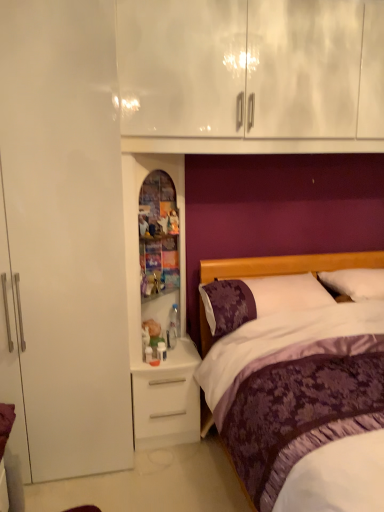
The width and height of the screenshot is (384, 512). Identify the location of white glossy medicine cabinet at center. (137, 232).

Locate an element on the screen. purple satin pillow at right, the first pillow when ordered from right to left is located at coordinates (355, 283).

Describe the element at coordinates (355, 283) in the screenshot. I see `purple satin pillow at right, which appears as the 2th pillow when viewed from the left` at that location.

Identify the location of purple satin bed at center. This screenshot has width=384, height=512. (287, 265).

This screenshot has width=384, height=512. Identify the location of white matte desk at lower center. (167, 399).

Locate an element on the screen. This screenshot has height=512, width=384. white glossy medicine cabinet at center is located at coordinates (137, 232).

From a real-world perspective, which pillow is the 1st one underneath the white glossy medicine cabinet at center? Please provide its 2D coordinates.

[(355, 283)]

How distant is white glossy medicine cabinet at center from purple satin pillow at right, the first pillow when ordered from right to left?

white glossy medicine cabinet at center is 3.33 feet away from purple satin pillow at right, the first pillow when ordered from right to left.

Is white glossy medicine cabinet at center located outside purple satin pillow at right, which appears as the 2th pillow when viewed from the left?

Indeed, white glossy medicine cabinet at center is completely outside purple satin pillow at right, which appears as the 2th pillow when viewed from the left.

Between white glossy medicine cabinet at center and purple satin pillow at right, the first pillow when ordered from right to left, which one has smaller size?

purple satin pillow at right, the first pillow when ordered from right to left.

Choose the correct answer: Is white matte desk at lower center inside purple satin bed at center or outside it?

white matte desk at lower center exists outside the volume of purple satin bed at center.

From the image's perspective, is white matte desk at lower center above or below purple satin bed at center?

white matte desk at lower center is below purple satin bed at center.

Which point is more forward, (158, 384) or (208, 336)?

The point (158, 384) is closer.

From the image's perspective, is purple floral pillow at right, the 1th pillow in the left-to-right sequence, above or below purple satin pillow at right, which appears as the 2th pillow when viewed from the left?

Clearly, from the image's perspective, purple floral pillow at right, the 1th pillow in the left-to-right sequence, is below purple satin pillow at right, which appears as the 2th pillow when viewed from the left.

Is purple floral pillow at right, which appears as the second pillow when viewed from the right, further to camera compared to purple satin pillow at right, the first pillow when ordered from right to left?

No, the depth of purple floral pillow at right, which appears as the second pillow when viewed from the right, is less than that of purple satin pillow at right, the first pillow when ordered from right to left.

From a real-world perspective, between purple floral pillow at right, the 1th pillow in the left-to-right sequence, and purple satin pillow at right, which appears as the 2th pillow when viewed from the left, who is vertically lower?

purple floral pillow at right, the 1th pillow in the left-to-right sequence, from a real-world perspective.

Can you confirm if purple floral pillow at right, the 1th pillow in the left-to-right sequence, is wider than purple satin pillow at right, which appears as the 2th pillow when viewed from the left?

Yes.

Are purple floral pillow at right, the 1th pillow in the left-to-right sequence, and purple satin bed at center located far from each other?

purple floral pillow at right, the 1th pillow in the left-to-right sequence, is near purple satin bed at center, not far away.

Is point (238, 301) closer to viewer compared to point (282, 269)?

Yes, point (238, 301) is in front of point (282, 269).

Can you confirm if purple floral pillow at right, which appears as the second pillow when viewed from the right, is positioned to the left of purple satin bed at center?

Yes.

Between purple floral pillow at right, the 1th pillow in the left-to-right sequence, and purple satin bed at center, which one has smaller size?

purple floral pillow at right, the 1th pillow in the left-to-right sequence.

Which is in front, point (217, 325) or point (129, 199)?

The point (129, 199) is closer to the camera.

This screenshot has height=512, width=384. Find the location of `medicine cabinet in front of the purple floral pillow at right, which appears as the second pillow when viewed from the right`. medicine cabinet in front of the purple floral pillow at right, which appears as the second pillow when viewed from the right is located at coordinates (137, 232).

Is purple floral pillow at right, which appears as the second pillow when viewed from the right, looking in the opposite direction of white glossy medicine cabinet at center?

No, purple floral pillow at right, which appears as the second pillow when viewed from the right, is not facing the opposite direction of white glossy medicine cabinet at center.

Would you say white glossy medicine cabinet at center is part of purple floral pillow at right, the 1th pillow in the left-to-right sequence,'s contents?

No.

Is purple floral pillow at right, the 1th pillow in the left-to-right sequence, facing away from white matte desk at lower center?

purple floral pillow at right, the 1th pillow in the left-to-right sequence, does not have its back to white matte desk at lower center.

What are the coordinates of `pillow in front of the white matte desk at lower center` in the screenshot? It's located at tap(258, 298).

In the scene shown: From the image's perspective, is purple floral pillow at right, which appears as the second pillow when viewed from the right, positioned above or below white matte desk at lower center?

Based on their image positions, purple floral pillow at right, which appears as the second pillow when viewed from the right, is located above white matte desk at lower center.

Which is more to the right, purple floral pillow at right, which appears as the second pillow when viewed from the right, or white matte desk at lower center?

From the viewer's perspective, purple floral pillow at right, which appears as the second pillow when viewed from the right, appears more on the right side.

Is purple satin pillow at right, the first pillow when ordered from right to left, positioned far away from white matte desk at lower center?

Yes, purple satin pillow at right, the first pillow when ordered from right to left, and white matte desk at lower center are located far from each other.

Could you tell me if purple satin pillow at right, the first pillow when ordered from right to left, is turned towards white matte desk at lower center?

No, purple satin pillow at right, the first pillow when ordered from right to left, is not facing towards white matte desk at lower center.

Based on the photo, is purple satin pillow at right, the first pillow when ordered from right to left, thinner than white matte desk at lower center?

Correct, the width of purple satin pillow at right, the first pillow when ordered from right to left, is less than that of white matte desk at lower center.

Find the location of a particular element. medicine cabinet above the purple satin pillow at right, which appears as the 2th pillow when viewed from the left (from a real-world perspective) is located at coordinates (137, 232).

I want to click on bed lying on the right of white matte desk at lower center, so click(287, 265).

From the picture: From the image, which object appears to be nearer to purple floral pillow at right, the 1th pillow in the left-to-right sequence, white matte desk at lower center or purple satin pillow at right, the first pillow when ordered from right to left?

purple satin pillow at right, the first pillow when ordered from right to left.

Which object lies nearer to the anchor point white glossy medicine cabinet at center, purple floral pillow at right, which appears as the second pillow when viewed from the right, or purple satin pillow at right, which appears as the 2th pillow when viewed from the left?

purple floral pillow at right, which appears as the second pillow when viewed from the right.

When comparing their distances from purple floral pillow at right, the 1th pillow in the left-to-right sequence, does white glossy medicine cabinet at center or purple satin pillow at right, the first pillow when ordered from right to left, seem further?

white glossy medicine cabinet at center is positioned further to the anchor purple floral pillow at right, the 1th pillow in the left-to-right sequence.

Which object lies further to the anchor point white glossy medicine cabinet at center, white matte desk at lower center or purple satin bed at center?

The object further to white glossy medicine cabinet at center is purple satin bed at center.

Which object lies further to the anchor point purple satin pillow at right, which appears as the 2th pillow when viewed from the left, purple floral pillow at right, which appears as the second pillow when viewed from the right, or white matte desk at lower center?

Among the two, white matte desk at lower center is located further to purple satin pillow at right, which appears as the 2th pillow when viewed from the left.

Looking at the image, which one is located further to white matte desk at lower center, purple floral pillow at right, which appears as the second pillow when viewed from the right, or purple satin bed at center?

Among the two, purple satin bed at center is located further to white matte desk at lower center.

Considering their positions, is purple satin pillow at right, which appears as the 2th pillow when viewed from the left, positioned further to white glossy medicine cabinet at center than purple satin bed at center?

Based on the image, purple satin pillow at right, which appears as the 2th pillow when viewed from the left, appears to be further to white glossy medicine cabinet at center.

Which object lies nearer to the anchor point purple satin pillow at right, which appears as the 2th pillow when viewed from the left, white glossy medicine cabinet at center or white matte desk at lower center?

white glossy medicine cabinet at center.

The height and width of the screenshot is (512, 384). In order to click on medicine cabinet between purple satin bed at center and white matte desk at lower center in the front-back direction in this screenshot , I will do `click(137, 232)`.

The image size is (384, 512). I want to click on medicine cabinet positioned between purple satin bed at center and purple floral pillow at right, which appears as the second pillow when viewed from the right, from near to far, so click(137, 232).

This screenshot has height=512, width=384. Find the location of `pillow situated between white glossy medicine cabinet at center and purple satin pillow at right, which appears as the 2th pillow when viewed from the left, from left to right`. pillow situated between white glossy medicine cabinet at center and purple satin pillow at right, which appears as the 2th pillow when viewed from the left, from left to right is located at coordinates (258, 298).

Locate an element on the screen. Image resolution: width=384 pixels, height=512 pixels. pillow between purple satin bed at center and white matte desk at lower center along the z-axis is located at coordinates (258, 298).